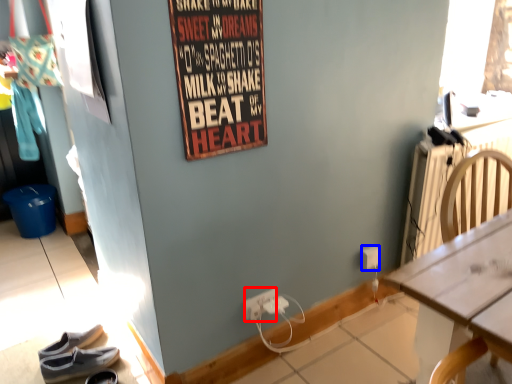
Question: Which object is closer to the camera taking this photo, power outlet (highlighted by a red box) or power outlet (highlighted by a blue box)?

Choices:
 (A) power outlet
 (B) power outlet

Answer: (A)